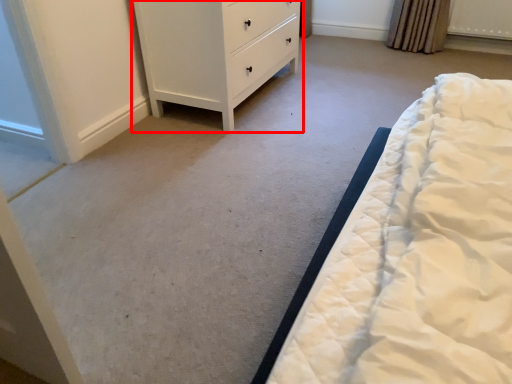
Question: From the image's perspective, considering the relative positions of chest of drawers (annotated by the red box) and radiator in the image provided, where is chest of drawers (annotated by the red box) located with respect to the staircase?

Choices:
 (A) below
 (B) above

Answer: (A)